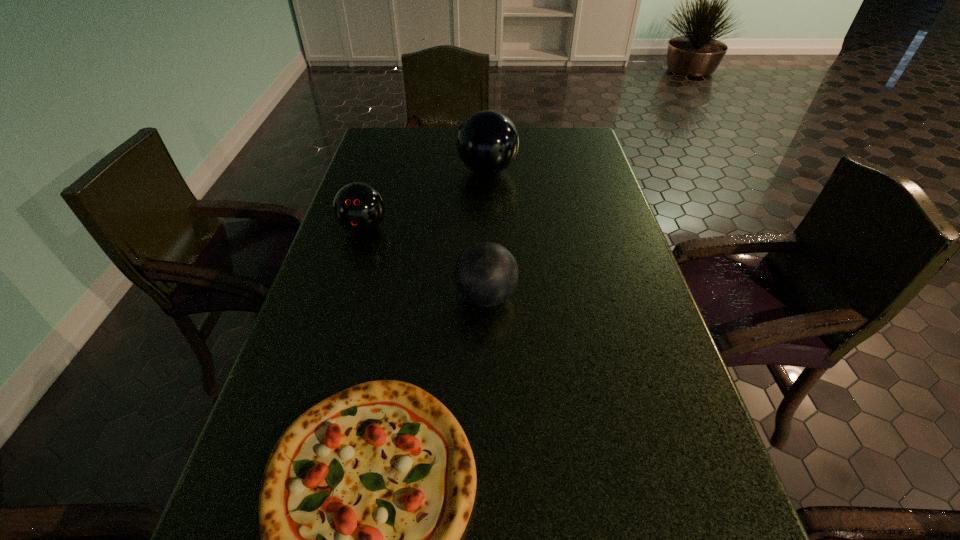
This screenshot has width=960, height=540. I want to click on free space located on the grip area of the third farthest object, so click(x=339, y=297).

Image resolution: width=960 pixels, height=540 pixels. Find the location of `free location located 0.300m on the surface of the second farthest object near the finger holes`. free location located 0.300m on the surface of the second farthest object near the finger holes is located at coordinates (330, 336).

Identify the location of object that is at the far edge. The height and width of the screenshot is (540, 960). (487, 143).

Find the location of a particular element. The image size is (960, 540). object positioned at the left edge is located at coordinates (358, 207).

Locate an element on the screen. This screenshot has width=960, height=540. free space at the far edge of the desktop is located at coordinates (516, 159).

Find the location of a particular element. The width and height of the screenshot is (960, 540). blank space at the left edge of the desktop is located at coordinates (356, 284).

The height and width of the screenshot is (540, 960). In order to click on vacant space at the right edge of the desktop in this screenshot , I will do `click(670, 423)`.

Identify the location of free space at the far left corner of the desktop. (374, 160).

Where is `free space at the far right corner of the desktop`? free space at the far right corner of the desktop is located at coordinates (577, 129).

Locate an element on the screen. The height and width of the screenshot is (540, 960). free space between the farthest bowling ball and the second nearest object is located at coordinates (487, 234).